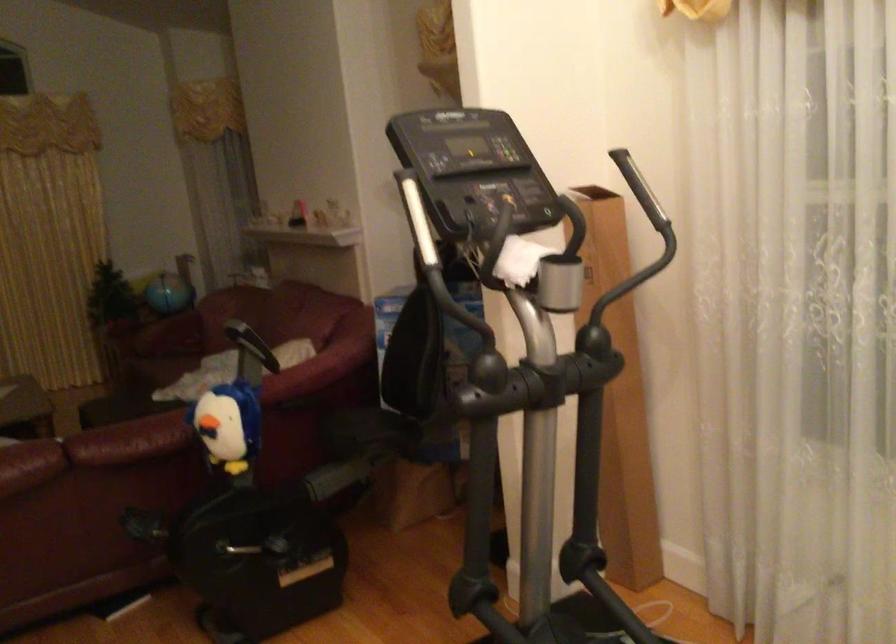
Question: The camera is either moving clockwise (left) or counter-clockwise (right) around the object. The first image is from the beginning of the video and the second image is from the end. Is the camera moving left or right when shooting the video?

Choices:
 (A) Left
 (B) Right

Answer: (B)